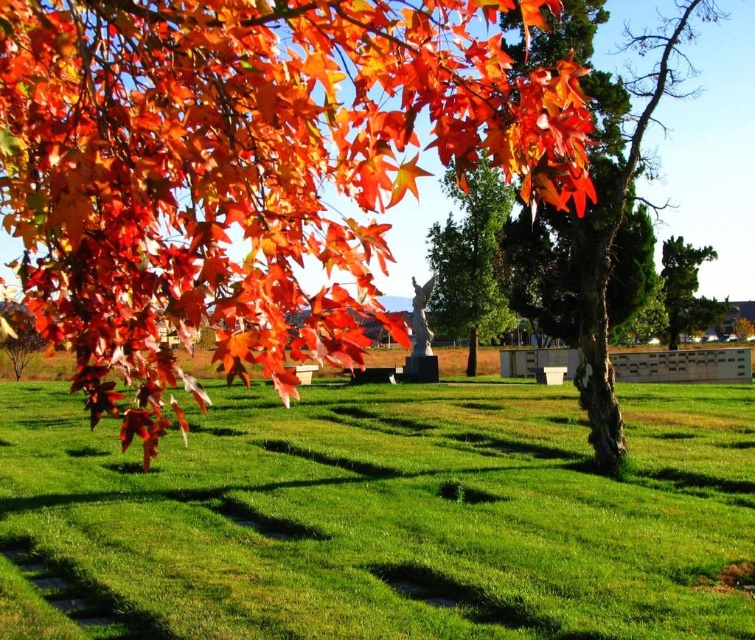
Question: Which object appears closest to the camera in this image?

Choices:
 (A) smooth green tree at center
 (B) shiny orange leaves at upper left

Answer: (B)

Question: Can you confirm if shiny orange leaves at upper left is positioned below green textured tree at center-right?

Choices:
 (A) yes
 (B) no

Answer: (A)

Question: Which of the following is the closest to the observer?

Choices:
 (A) brown rough bark tree at center
 (B) shiny orange leaves at upper left
 (C) smooth green tree at center
 (D) green textured tree at center-right

Answer: (B)

Question: Does green grass at center have a larger size compared to green textured tree at center-right?

Choices:
 (A) no
 (B) yes

Answer: (A)

Question: Which point is closer to the camera?

Choices:
 (A) (291, 278)
 (B) (689, 288)

Answer: (A)

Question: Is green grass at center positioned at the back of green textured tree at center-right?

Choices:
 (A) yes
 (B) no

Answer: (B)